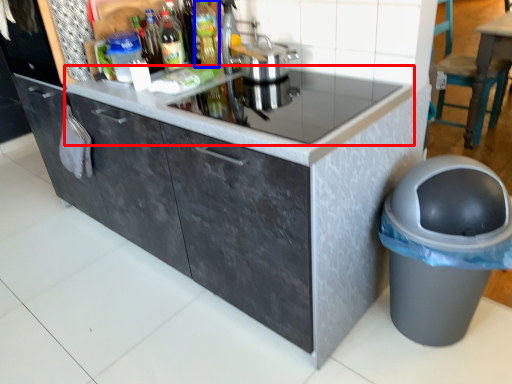
Question: Which point is closer to the camera, countertop (highlighted by a red box) or bottle (highlighted by a blue box)?

Choices:
 (A) countertop
 (B) bottle

Answer: (A)